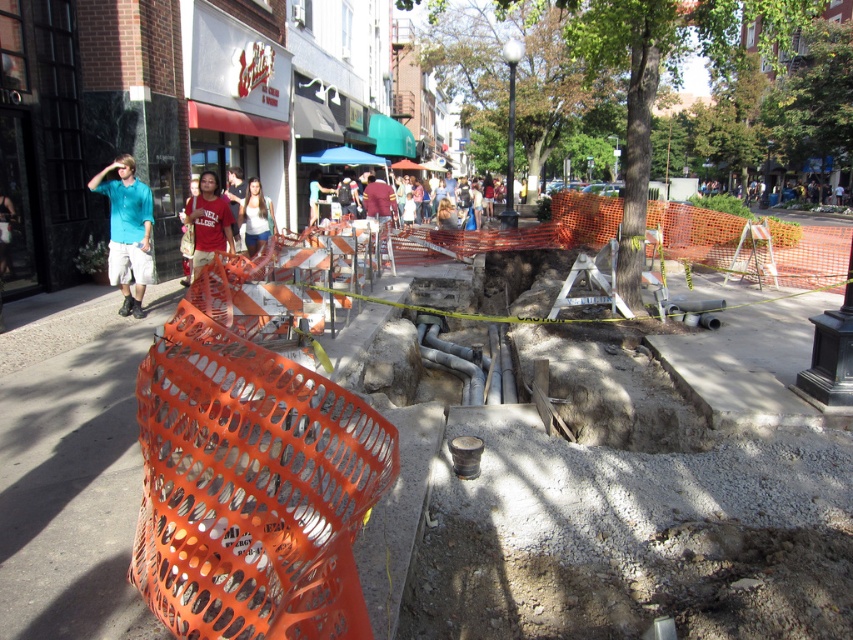
Does orange plastic barrier at center lie in front of teal shirt at left?

That is True.

What do you see at coordinates (585, 493) in the screenshot? This screenshot has width=853, height=640. I see `orange plastic barrier at center` at bounding box center [585, 493].

Identify the location of orange plastic barrier at center. This screenshot has width=853, height=640. (585, 493).

Who is higher up, matte red t-shirt at center or matte white shirt at center?

matte white shirt at center is above.

Who is more forward, (218, 202) or (260, 220)?

Point (218, 202) is in front.

I want to click on matte red t-shirt at center, so click(x=207, y=220).

Can you confirm if orange plastic barrier at center is positioned to the left of matte white shirt at center?

No, orange plastic barrier at center is not to the left of matte white shirt at center.

Does point (503, 540) come in front of point (248, 182)?

Yes, point (503, 540) is in front of point (248, 182).

Where is `orange plastic barrier at center`? orange plastic barrier at center is located at coordinates (585, 493).